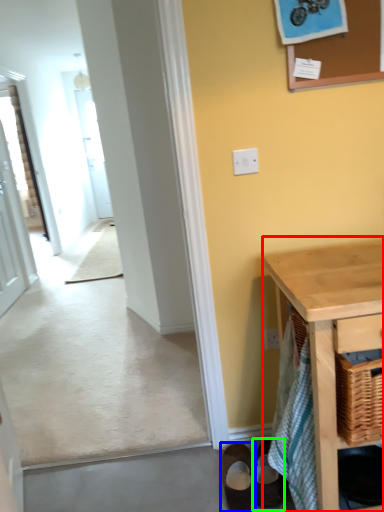
Question: Based on their relative distances, which object is nearer to table (highlighted by a red box)? Choose from footwear (highlighted by a blue box) and footwear (highlighted by a green box).

Choices:
 (A) footwear
 (B) footwear

Answer: (B)